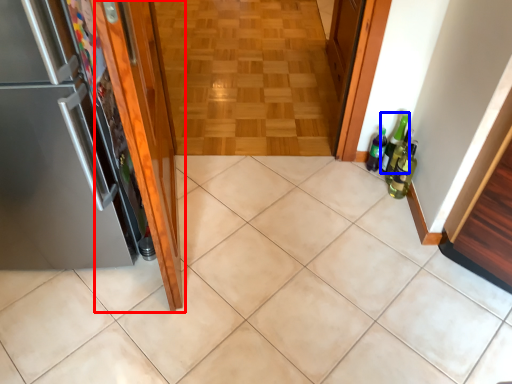
Question: Among these objects, which one is nearest to the camera, door (highlighted by a red box) or beer bottle (highlighted by a blue box)?

Choices:
 (A) door
 (B) beer bottle

Answer: (A)